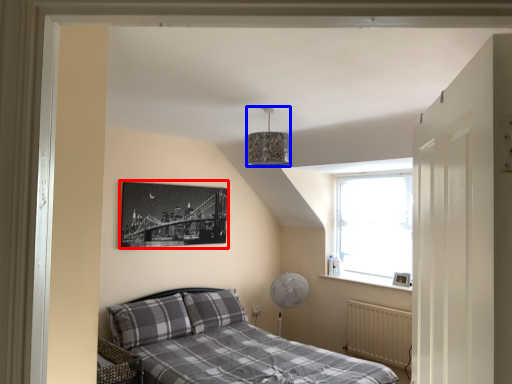
Question: Which object appears closest to the camera in this image, picture frame (highlighted by a red box) or lamp (highlighted by a blue box)?

Choices:
 (A) picture frame
 (B) lamp

Answer: (B)